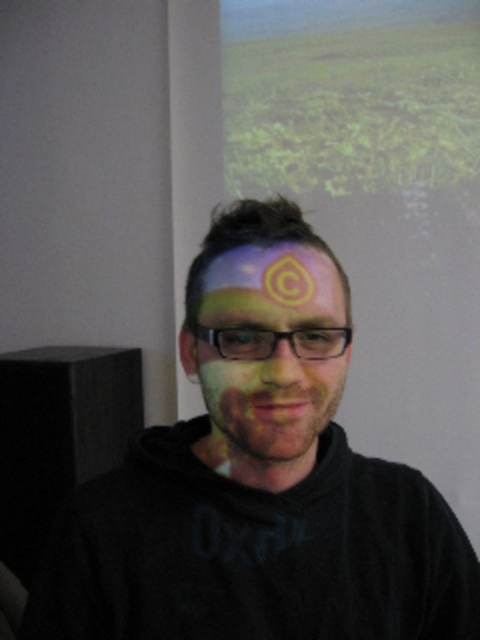
Question: Observing the image, what is the correct spatial positioning of matte painted face at center in reference to painted face at center?

Choices:
 (A) left
 (B) right

Answer: (B)

Question: Which of the following is the closest to the observer?

Choices:
 (A) matte painted face at center
 (B) painted face at center

Answer: (B)

Question: Is matte painted face at center smaller than painted face at center?

Choices:
 (A) yes
 (B) no

Answer: (B)

Question: Among these objects, which one is nearest to the camera?

Choices:
 (A) matte painted face at center
 (B) painted face at center

Answer: (B)

Question: Is matte painted face at center bigger than painted face at center?

Choices:
 (A) yes
 (B) no

Answer: (A)